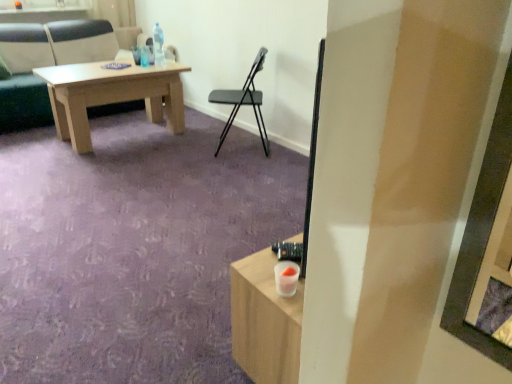
Question: From a real-world perspective, does light brown wooden table at upper left, the 1th chair in the left-to-right sequence, stand above clear plastic bottle at upper center?

Choices:
 (A) yes
 (B) no

Answer: (B)

Question: Can you confirm if light brown wooden table at upper left, which is the 2th chair from right to left, is bigger than clear plastic bottle at upper center?

Choices:
 (A) no
 (B) yes

Answer: (B)

Question: Could you tell me if light brown wooden table at upper left, marked as the 2th chair in a front-to-back arrangement, is facing clear plastic bottle at upper center?

Choices:
 (A) no
 (B) yes

Answer: (B)

Question: Is light brown wooden table at upper left, marked as the 2th chair in a front-to-back arrangement, beside clear plastic bottle at upper center?

Choices:
 (A) no
 (B) yes

Answer: (A)

Question: Considering the relative positions of light brown wooden table at upper left, which is the 2th chair from right to left, and clear plastic bottle at upper center in the image provided, is light brown wooden table at upper left, which is the 2th chair from right to left, in front of clear plastic bottle at upper center?

Choices:
 (A) no
 (B) yes

Answer: (B)

Question: From the image's perspective, is light brown wooden table at upper left, which is counted as the first chair, starting from the back, below clear plastic bottle at upper center?

Choices:
 (A) yes
 (B) no

Answer: (B)

Question: Considering the relative sizes of clear plastic bottle at upper center and light brown wooden table at upper left, which is counted as the first chair, starting from the back, in the image provided, is clear plastic bottle at upper center bigger than light brown wooden table at upper left, which is counted as the first chair, starting from the back,?

Choices:
 (A) no
 (B) yes

Answer: (A)

Question: Is clear plastic bottle at upper center positioned beyond the bounds of light brown wooden table at upper left, which is counted as the first chair, starting from the back?

Choices:
 (A) no
 (B) yes

Answer: (B)

Question: Is clear plastic bottle at upper center at the left side of light brown wooden table at upper left, marked as the 2th chair in a front-to-back arrangement?

Choices:
 (A) no
 (B) yes

Answer: (A)

Question: Is clear plastic bottle at upper center looking in the opposite direction of light brown wooden table at upper left, which is the 2th chair from right to left?

Choices:
 (A) no
 (B) yes

Answer: (B)

Question: Can you confirm if clear plastic bottle at upper center is wider than light brown wooden table at upper left, which is the 2th chair from right to left?

Choices:
 (A) yes
 (B) no

Answer: (B)

Question: Does clear plastic bottle at upper center have a lesser height compared to light brown wooden table at upper left, which is counted as the first chair, starting from the back?

Choices:
 (A) no
 (B) yes

Answer: (B)

Question: From the image's perspective, is black plastic chair at center, the second chair in the back-to-front sequence, on top of light brown wooden table at upper left, which is counted as the first chair, starting from the back?

Choices:
 (A) yes
 (B) no

Answer: (B)